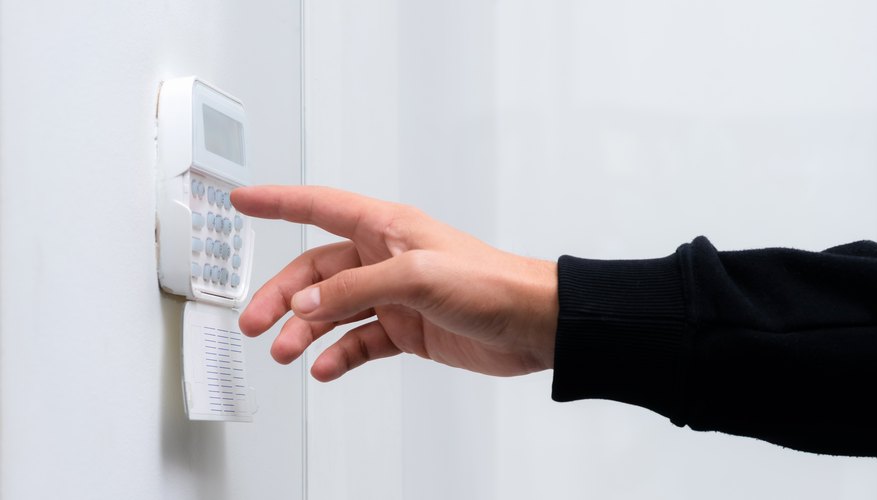
Find the location of a particular element. The width and height of the screenshot is (877, 500). display screen is located at coordinates (219, 126).